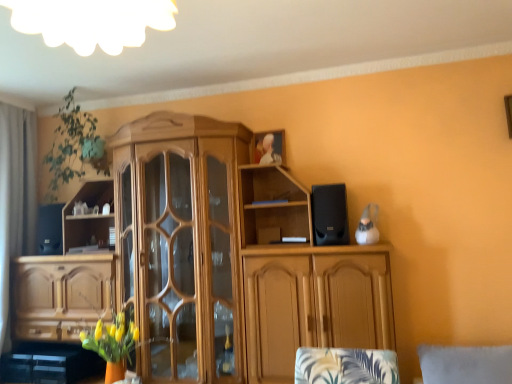
Describe the element at coordinates (329, 215) in the screenshot. I see `black matte speaker at upper right, the first speaker when ordered from front to back` at that location.

Locate an element on the screen. The image size is (512, 384). green leafy plant at upper left is located at coordinates (74, 147).

The height and width of the screenshot is (384, 512). What do you see at coordinates (49, 229) in the screenshot?
I see `black matte speaker at left, marked as the first speaker in a back-to-front arrangement` at bounding box center [49, 229].

The width and height of the screenshot is (512, 384). Identify the location of black matte speaker at upper right, the second speaker when ordered from left to right. (329, 215).

Could you tell me if wooden cabinet at center is turned towards green leafy plant at upper left?

No, wooden cabinet at center is not aimed at green leafy plant at upper left.

How much distance is there between wooden cabinet at center and green leafy plant at upper left?

→ They are 36.51 inches apart.

From a real-world perspective, is wooden cabinet at center on green leafy plant at upper left?

Actually, wooden cabinet at center is physically below green leafy plant at upper left in the real world.

Between wooden cabinet at center and green leafy plant at upper left, which one has smaller width?

Thinner between the two is green leafy plant at upper left.

From their relative heights in the image, would you say black matte speaker at upper right, arranged as the second speaker when viewed from the back, is taller or shorter than black matte speaker at left, which is counted as the first speaker, starting from the left?

Clearly, black matte speaker at upper right, arranged as the second speaker when viewed from the back, is taller compared to black matte speaker at left, which is counted as the first speaker, starting from the left.

Which object is more forward, black matte speaker at upper right, the first speaker when ordered from front to back, or black matte speaker at left, which is counted as the first speaker, starting from the left?

black matte speaker at upper right, the first speaker when ordered from front to back, is closer to the camera.

Which of these two, black matte speaker at upper right, arranged as the second speaker when viewed from the back, or black matte speaker at left, marked as the first speaker in a back-to-front arrangement, is thinner?

With smaller width is black matte speaker at upper right, arranged as the second speaker when viewed from the back.

From the image's perspective, is wooden cabinet at center below black matte speaker at upper right, the first speaker when ordered from front to back?

Correct, wooden cabinet at center appears lower than black matte speaker at upper right, the first speaker when ordered from front to back, in the image.

From a real-world perspective, which object rests below the other?

wooden cabinet at center.

Which point is more distant from viewer, (192, 250) or (340, 211)?

Positioned behind is point (192, 250).

Is wooden cabinet at center aimed at black matte speaker at upper right, the first speaker viewed from the right?

Yes, wooden cabinet at center faces towards black matte speaker at upper right, the first speaker viewed from the right.

Is gray fabric curtain at left not inside black matte speaker at upper right, arranged as the second speaker when viewed from the back?

Yes.

In terms of width, does gray fabric curtain at left look wider or thinner when compared to black matte speaker at upper right, the second speaker when ordered from left to right?

In the image, gray fabric curtain at left appears to be wider than black matte speaker at upper right, the second speaker when ordered from left to right.

Considering the sizes of gray fabric curtain at left and black matte speaker at upper right, the first speaker viewed from the right, in the image, is gray fabric curtain at left bigger or smaller than black matte speaker at upper right, the first speaker viewed from the right,?

In the image, gray fabric curtain at left appears to be larger than black matte speaker at upper right, the first speaker viewed from the right.

From the image's perspective, is gray fabric curtain at left located above or below black matte speaker at upper right, the second speaker when ordered from left to right?

gray fabric curtain at left is below black matte speaker at upper right, the second speaker when ordered from left to right.

In the scene shown: Can you tell me how much green leafy plant at upper left and gray fabric curtain at left differ in facing direction?

90 degrees separate the facing orientations of green leafy plant at upper left and gray fabric curtain at left.

In the scene shown: Between green leafy plant at upper left and gray fabric curtain at left, which one appears on the left side from the viewer's perspective?

gray fabric curtain at left is more to the left.

Is green leafy plant at upper left positioned before gray fabric curtain at left?

Yes, it is.

Which is nearer, (x=6, y=314) or (x=68, y=167)?

Point (x=6, y=314).

Locate an element on the screen. Image resolution: width=512 pixels, height=384 pixels. curtain behind the green leafy plant at upper left is located at coordinates 16,197.

From the image's perspective, does gray fabric curtain at left appear lower than green leafy plant at upper left?

Correct, gray fabric curtain at left appears lower than green leafy plant at upper left in the image.

From a real-world perspective, which is physically below, gray fabric curtain at left or green leafy plant at upper left?

gray fabric curtain at left, from a real-world perspective.

From a real-world perspective, who is located higher, wooden cabinet at center or gray fabric curtain at left?

In real-world perspective, gray fabric curtain at left is above.

Considering the relative positions of wooden cabinet at center and gray fabric curtain at left in the image provided, is wooden cabinet at center to the left of gray fabric curtain at left from the viewer's perspective?

No.

You are a GUI agent. You are given a task and a screenshot of the screen. Output one action in this format:
    pyautogui.click(x=<x>, y=<y>)
    Task: Click on the curtain lying above the wooden cabinet at center (from the image's perspective)
    
    Given the screenshot: What is the action you would take?
    pyautogui.click(x=16, y=197)

Is wooden cabinet at center inside the boundaries of gray fabric curtain at left, or outside?

The correct answer is: outside.

Identify the location of plant lying above the wooden cabinet at center (from the image's perspective). (74, 147).

Find the location of a particular element. speaker that is in front of the black matte speaker at left, the 2th speaker viewed from the front is located at coordinates (329, 215).

Looking at the image, which one is located closer to gray fabric curtain at left, wooden cabinet at center or black matte speaker at upper right, the first speaker when ordered from front to back?

The object closer to gray fabric curtain at left is wooden cabinet at center.

From the image, which object appears to be farther from wooden cabinet at center, green leafy plant at upper left or black matte speaker at left, the 2th speaker viewed from the front?

black matte speaker at left, the 2th speaker viewed from the front, lies further to wooden cabinet at center than the other object.

Estimate the real-world distances between objects in this image. Which object is further from black matte speaker at upper right, the second speaker when ordered from left to right, wooden cabinet at center or green leafy plant at upper left?

green leafy plant at upper left is further to black matte speaker at upper right, the second speaker when ordered from left to right.

From the image, which object appears to be nearer to wooden cabinet at center, black matte speaker at upper right, the second speaker when ordered from left to right, or gray fabric curtain at left?

Among the two, black matte speaker at upper right, the second speaker when ordered from left to right, is located nearer to wooden cabinet at center.

When comparing their distances from wooden cabinet at center, does green leafy plant at upper left or gray fabric curtain at left seem further?

gray fabric curtain at left.

When comparing their distances from black matte speaker at left, the 2th speaker viewed from the front, does green leafy plant at upper left or black matte speaker at upper right, the first speaker viewed from the right, seem further?

black matte speaker at upper right, the first speaker viewed from the right, is positioned further to the anchor black matte speaker at left, the 2th speaker viewed from the front.

Considering their positions, is black matte speaker at left, marked as the first speaker in a back-to-front arrangement, positioned closer to green leafy plant at upper left than black matte speaker at upper right, arranged as the second speaker when viewed from the back?

The object closer to green leafy plant at upper left is black matte speaker at left, marked as the first speaker in a back-to-front arrangement.

Which object lies further to the anchor point wooden cabinet at center, green leafy plant at upper left or black matte speaker at upper right, arranged as the second speaker when viewed from the back?

green leafy plant at upper left is positioned further to the anchor wooden cabinet at center.

Locate an element on the screen. cabinetry between black matte speaker at left, marked as the first speaker in a back-to-front arrangement, and black matte speaker at upper right, the first speaker viewed from the right, in the horizontal direction is located at coordinates (232, 258).

The image size is (512, 384). Identify the location of cabinetry between gray fabric curtain at left and black matte speaker at upper right, the second speaker when ordered from left to right. (232, 258).

Find the location of a particular element. This screenshot has height=384, width=512. speaker between gray fabric curtain at left and black matte speaker at upper right, arranged as the second speaker when viewed from the back is located at coordinates (49, 229).

Image resolution: width=512 pixels, height=384 pixels. I want to click on curtain that lies between green leafy plant at upper left and black matte speaker at left, the second speaker viewed from the right, from top to bottom, so click(x=16, y=197).